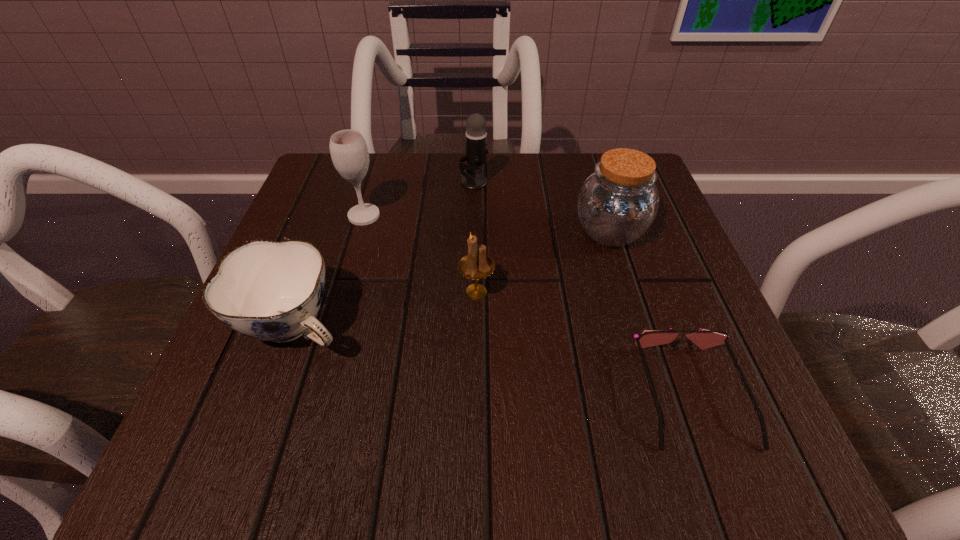
Identify the location of free space between the wineglass and the microphone. (419, 199).

The image size is (960, 540). Identify the location of free space between the second shortest object and the candle holder. (386, 309).

In order to click on free space between the jar and the shortest object in this screenshot , I will do `click(651, 312)`.

Image resolution: width=960 pixels, height=540 pixels. What are the coordinates of `free spot between the candle holder and the jar` in the screenshot? It's located at pos(543,262).

What are the coordinates of `vacant space that's between the chinaware and the microphone` in the screenshot? It's located at (385, 254).

At what (x,y) coordinates should I click in order to perform the action: click on free point between the farthest object and the wineglass. Please return your answer as a coordinate pair (x, y). The width and height of the screenshot is (960, 540). Looking at the image, I should click on (419, 199).

Image resolution: width=960 pixels, height=540 pixels. In order to click on object that is the second closest one to the shortest object in this screenshot , I will do `click(476, 265)`.

I want to click on object that stands as the third closest to the chinaware, so click(476, 136).

Where is `vacant space that satisfies the following two spatial constraints: 1. on the front side of the candle holder; 2. on the left side of the microphone`? Image resolution: width=960 pixels, height=540 pixels. vacant space that satisfies the following two spatial constraints: 1. on the front side of the candle holder; 2. on the left side of the microphone is located at coordinates (472, 292).

The width and height of the screenshot is (960, 540). What are the coordinates of `vacant space that satisfies the following two spatial constraints: 1. on the front side of the farthest object; 2. on the left side of the candle holder` in the screenshot? It's located at (472, 292).